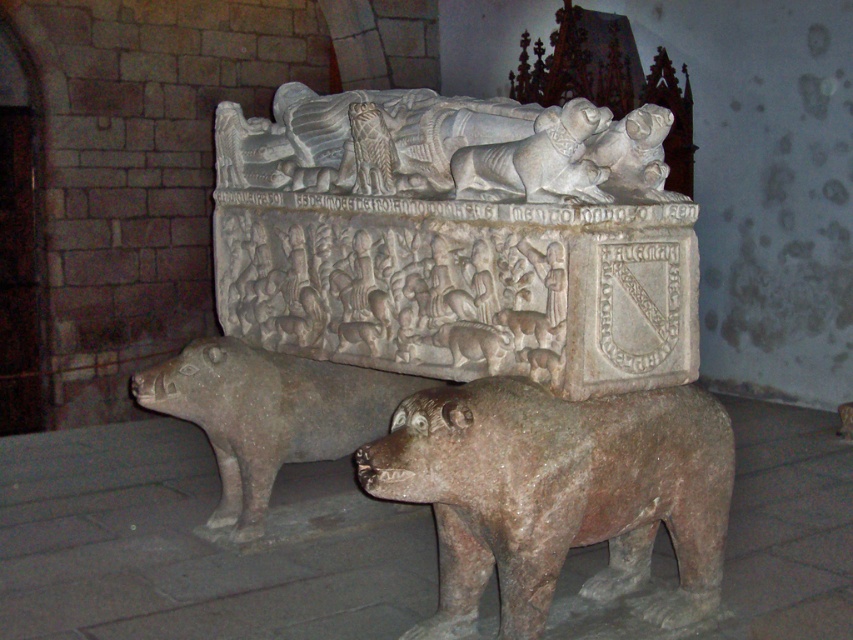
You are an art conservator assessing the stone pigs in the image. The rustic stone pig at lower left and the gray stone pig at center are both part of the historical display. Which pig has a greater height?

The rustic stone pig at lower left is taller than the gray stone pig at center, so the rustic stone pig at lower left has a greater height.